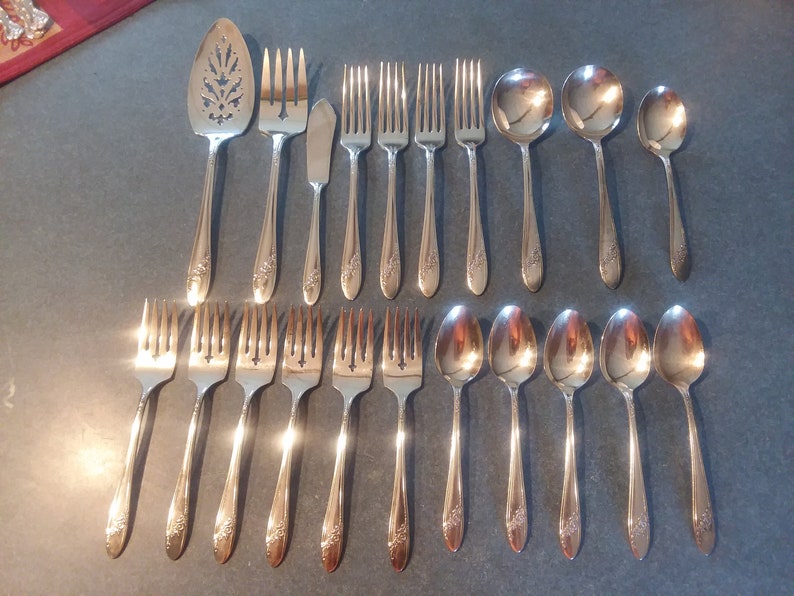
Where is `spoon handles`? spoon handles is located at coordinates click(195, 254), click(532, 250), click(607, 259), click(681, 243), click(707, 513), click(642, 529), click(571, 519), click(518, 514), click(453, 514).